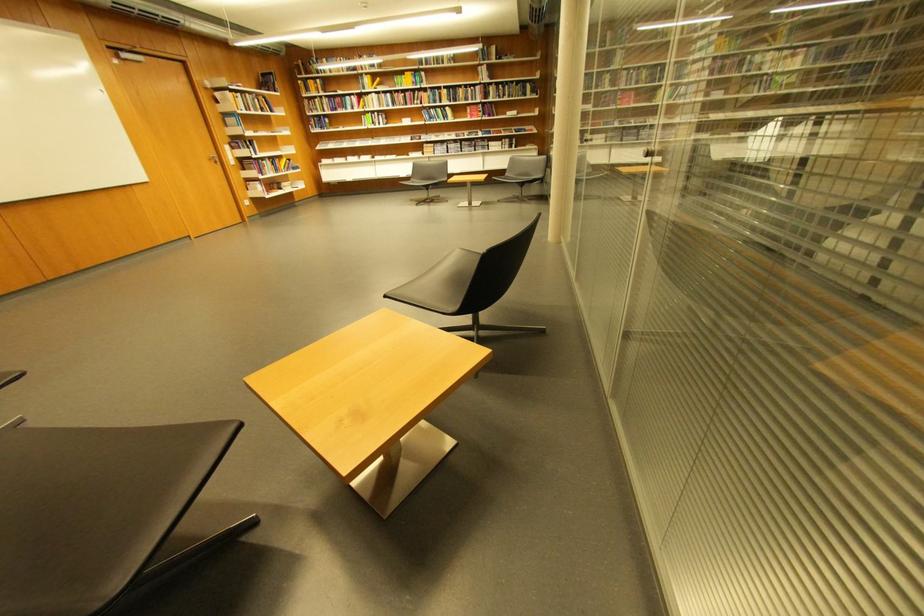
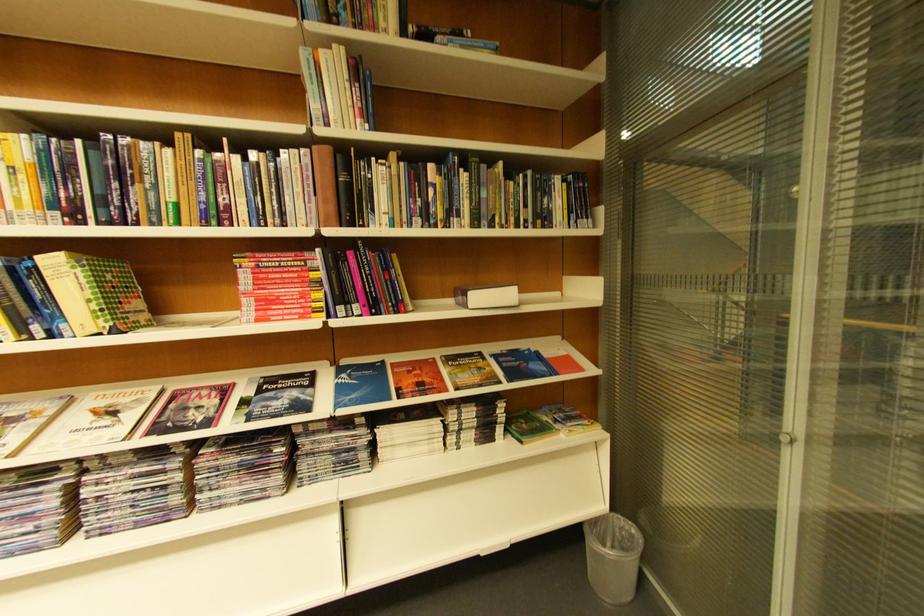
Locate, in the second image, the point that corresponds to pixel 502 61 in the first image.

(384, 31)